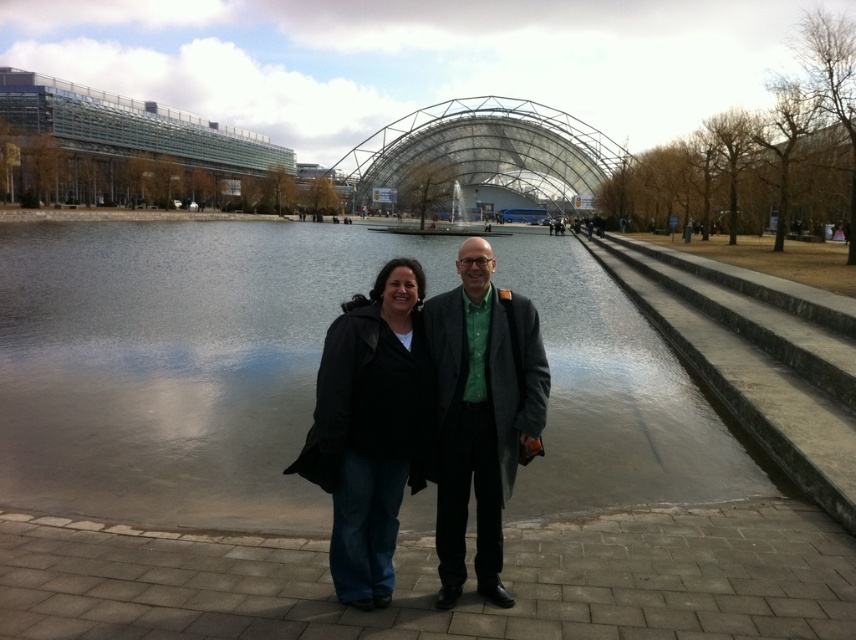
Does black leather jacket at center appear under matte gray coat at center?

Yes.

Does black leather jacket at center appear on the left side of matte gray coat at center?

Indeed, black leather jacket at center is positioned on the left side of matte gray coat at center.

Between point (330, 433) and point (438, 397), which one is positioned behind?

Point (438, 397)

You are a GUI agent. You are given a task and a screenshot of the screen. Output one action in this format:
    pyautogui.click(x=<x>, y=<y>)
    Task: Click on the black leather jacket at center
    
    Given the screenshot: What is the action you would take?
    pyautogui.click(x=369, y=428)

Can you confirm if smooth concrete water at center is wider than matte gray coat at center?

Correct, the width of smooth concrete water at center exceeds that of matte gray coat at center.

Who is positioned more to the right, smooth concrete water at center or matte gray coat at center?

From the viewer's perspective, matte gray coat at center appears more on the right side.

Between point (128, 320) and point (468, 476), which one is positioned in front?

Point (468, 476) is more forward.

Locate an element on the screen. The image size is (856, 640). smooth concrete water at center is located at coordinates [x=174, y=364].

Can you confirm if smooth concrete water at center is positioned below black leather jacket at center?

Incorrect, smooth concrete water at center is not positioned below black leather jacket at center.

Which is more to the left, smooth concrete water at center or black leather jacket at center?

Positioned to the left is smooth concrete water at center.

The height and width of the screenshot is (640, 856). Identify the location of smooth concrete water at center. (174, 364).

At what (x,y) coordinates should I click in order to perform the action: click on smooth concrete water at center. Please return your answer as a coordinate pair (x, y). Looking at the image, I should click on (174, 364).